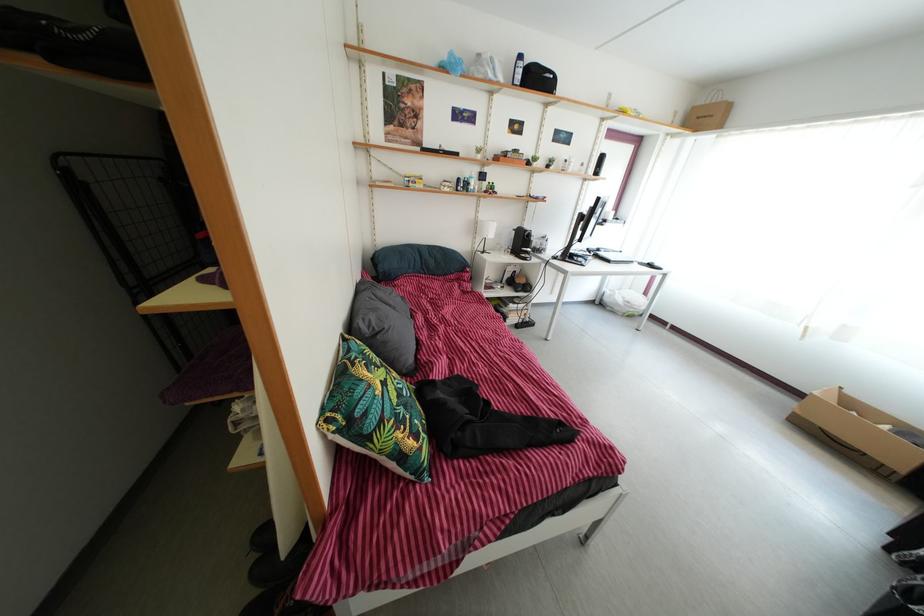
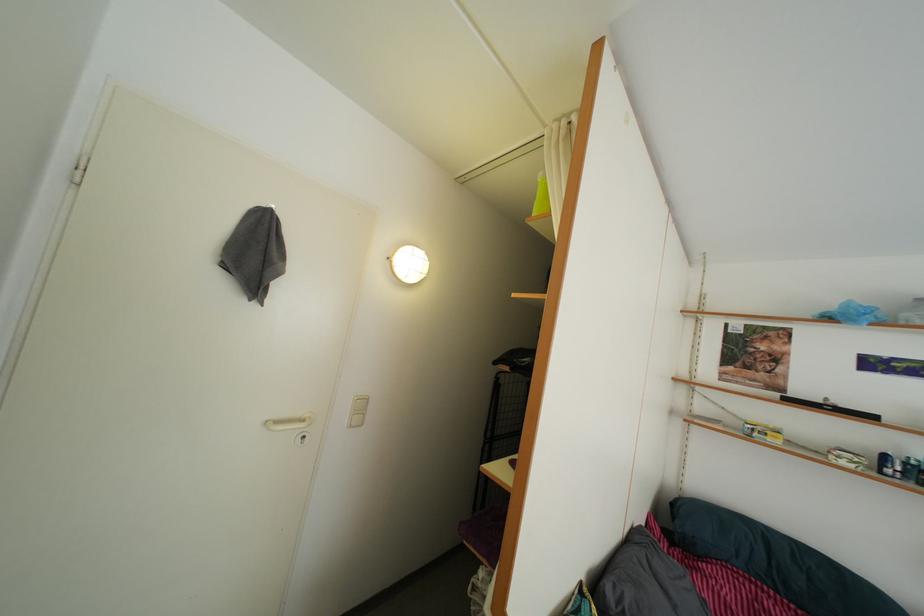
The images are taken continuously from a first-person perspective. In which direction is your viewpoint rotating?

The rotation direction of the camera is left-up.